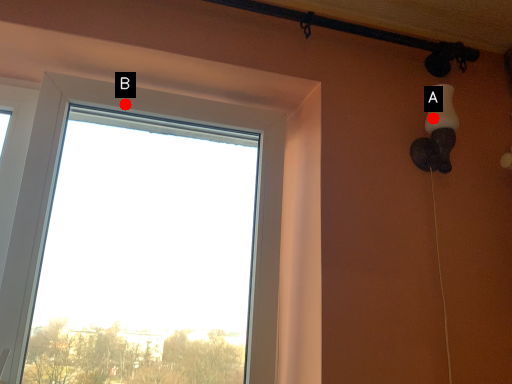
Question: Two points are circled on the image, labeled by A and B beside each circle. Which point is further to the camera?

Choices:
 (A) A is further
 (B) B is further

Answer: (B)